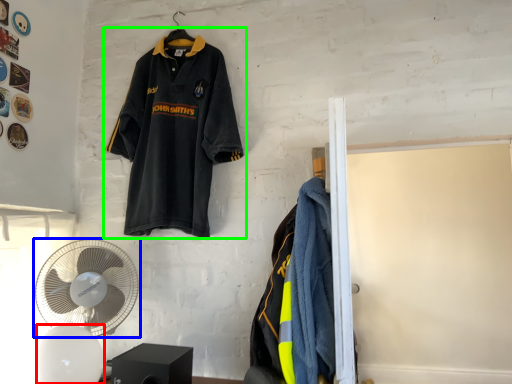
Question: Estimate the real-world distances between objects in this image. Which object is farther from mechanical fan (highlighted by a red box), mechanical fan (highlighted by a blue box) or sports uniform (highlighted by a green box)?

Choices:
 (A) mechanical fan
 (B) sports uniform

Answer: (B)